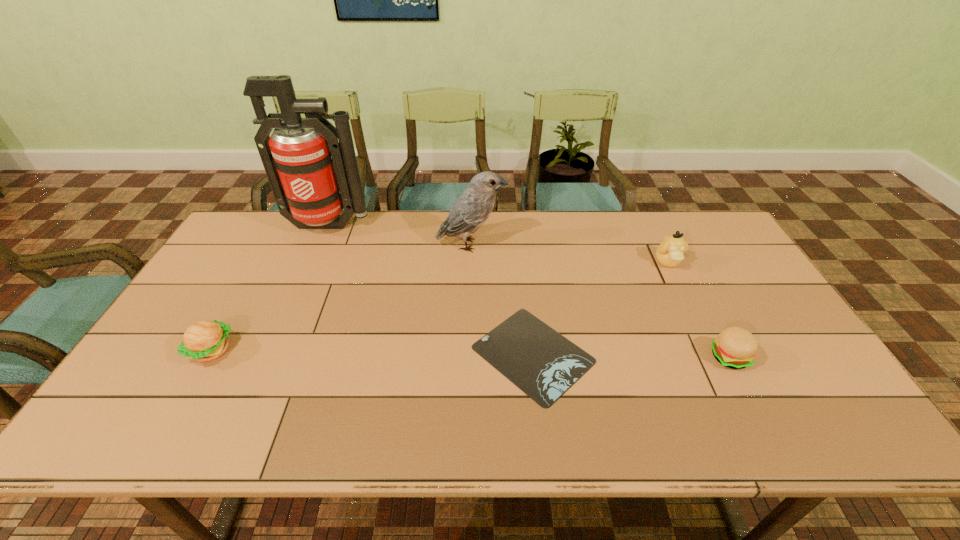
The image size is (960, 540). In order to click on the tallest object in this screenshot , I will do `click(313, 176)`.

In order to click on the fifth shortest object in this screenshot , I will do `click(472, 208)`.

Find the location of a particular element. the third tallest object is located at coordinates (669, 253).

At what (x,y) coordinates should I click in order to perform the action: click on the left hamburger. Please return your answer as a coordinate pair (x, y). This screenshot has height=540, width=960. Looking at the image, I should click on (203, 341).

Locate an element on the screen. Image resolution: width=960 pixels, height=540 pixels. the right hamburger is located at coordinates (735, 347).

Find the location of a particular element. The image size is (960, 540). the shortest object is located at coordinates (541, 362).

Identify the location of vacant region located on the front label side of the tallest object. The height and width of the screenshot is (540, 960). (308, 274).

The height and width of the screenshot is (540, 960). I want to click on free space located on the front-facing side of the fifth shortest object, so click(596, 245).

Locate an element on the screen. The width and height of the screenshot is (960, 540). free location located on the face of the third tallest object is located at coordinates (681, 288).

Locate an element on the screen. vacant space positioned 0.050m on the right of the left hamburger is located at coordinates (252, 350).